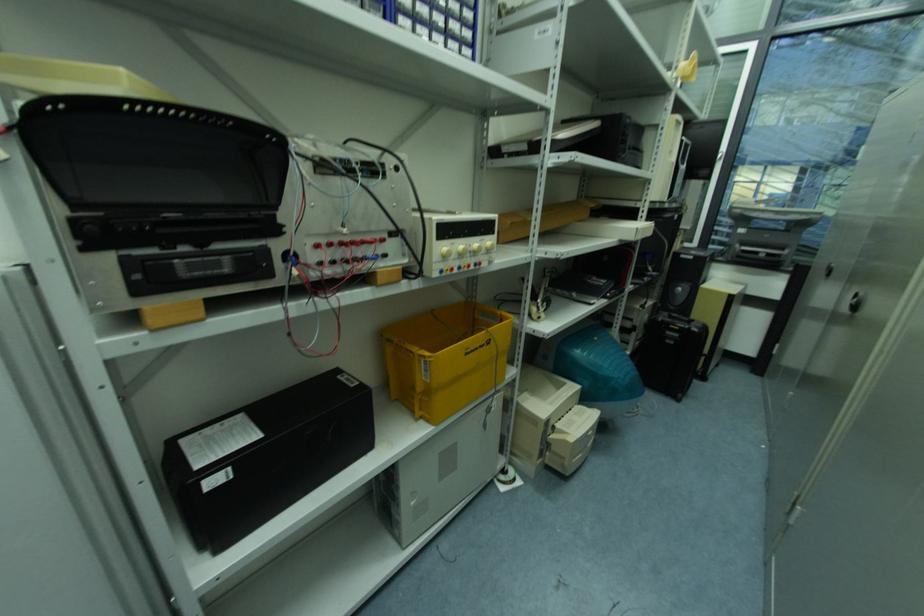
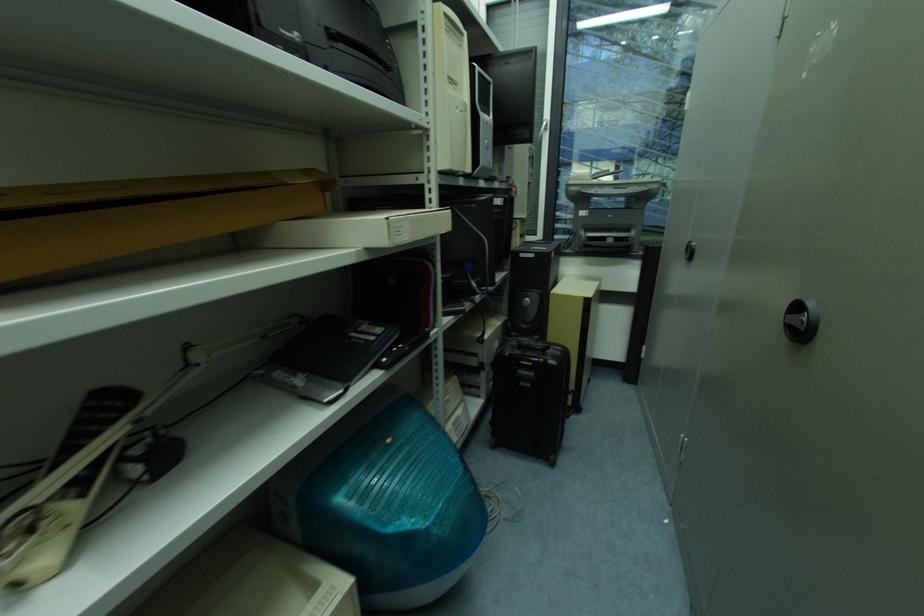
Which direction would the cameraman need to move to produce the second image?

The cameraman moved toward right, forward.